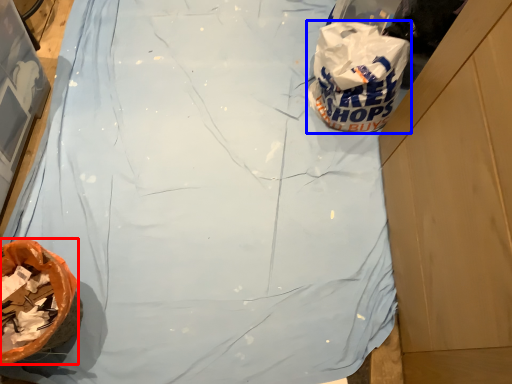
Question: Which of the following is the closest to the observer, waste (highlighted by a red box) or plastic bag (highlighted by a blue box)?

Choices:
 (A) waste
 (B) plastic bag

Answer: (A)